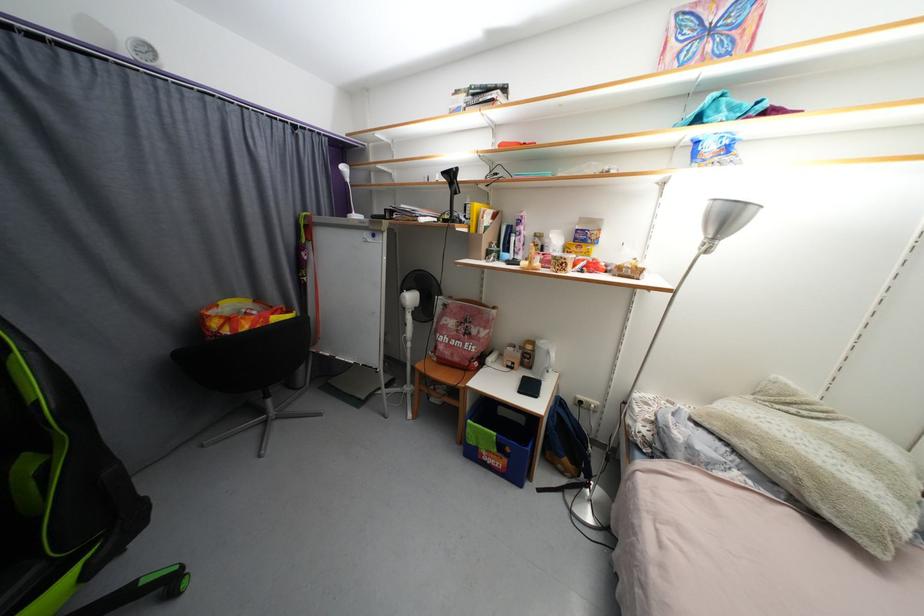
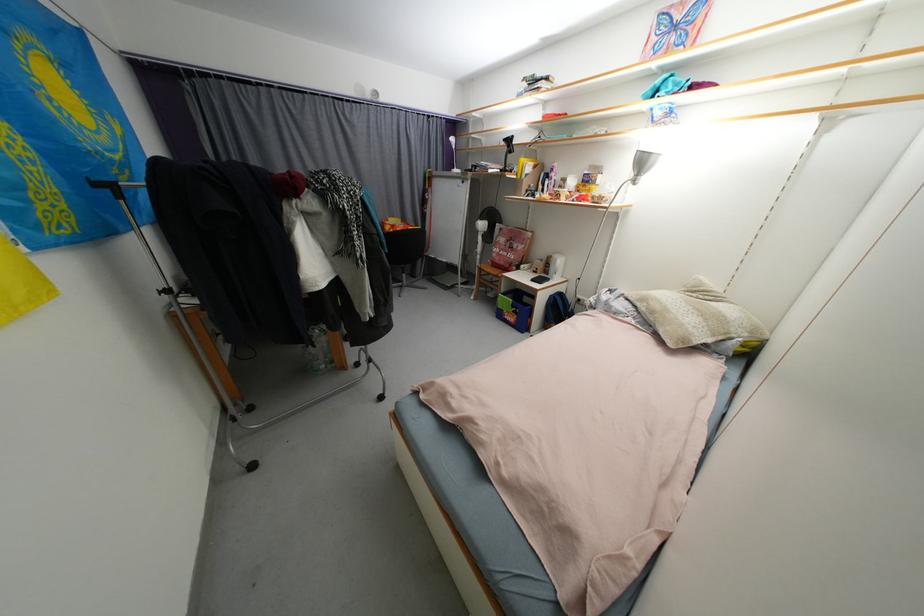
In the second image, find the point that corresponds to [785,466] in the first image.

(658, 314)